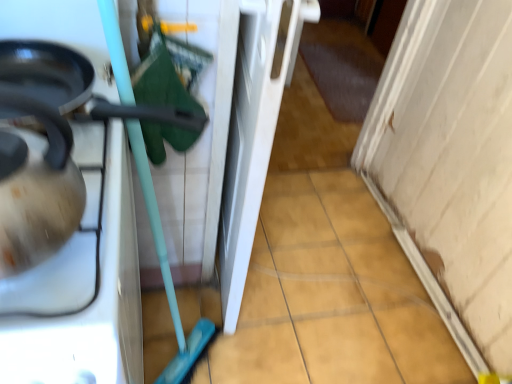
Question: From the image's perspective, is matte black kettle at left above or below matte white tea pot at left?

Choices:
 (A) below
 (B) above

Answer: (A)

Question: Is point (77, 31) closer or farther from the camera than point (15, 258)?

Choices:
 (A) closer
 (B) farther

Answer: (B)

Question: Which object is positioned farthest from the matte black kettle at left?

Choices:
 (A) matte white tea pot at left
 (B) shiny black frying pan at left

Answer: (A)

Question: Which of these objects is positioned farthest from the matte black kettle at left?

Choices:
 (A) shiny black frying pan at left
 (B) matte white tea pot at left

Answer: (B)